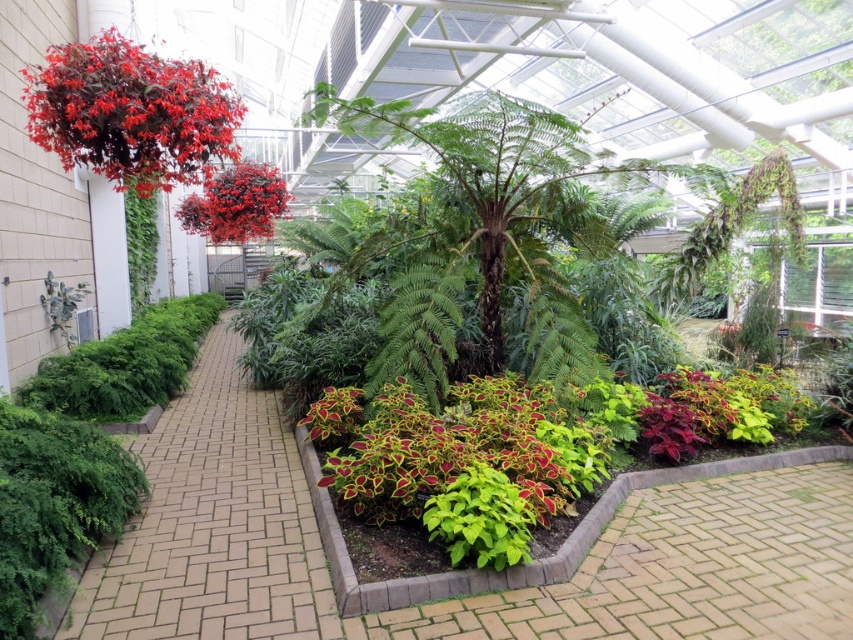
You are a gardener who needs to determine if the lush green foliage at center will block sunlight from reaching the matte red hanging basket at upper left. Based on their heights, can you confirm if the foliage is shorter than the basket?

The lush green foliage at center has a lesser height compared to matte red hanging basket at upper left, so yes, the foliage is shorter than the basket and will not block sunlight from reaching it.

You are a gardener who wants to place a new small statue between the lush green foliage at center and the matte red hanging basket at upper left. Which object should the statue be closer to if it needs to be near the larger one?

The statue should be placed closer to the lush green foliage at center because it is larger than the matte red hanging basket at upper left.